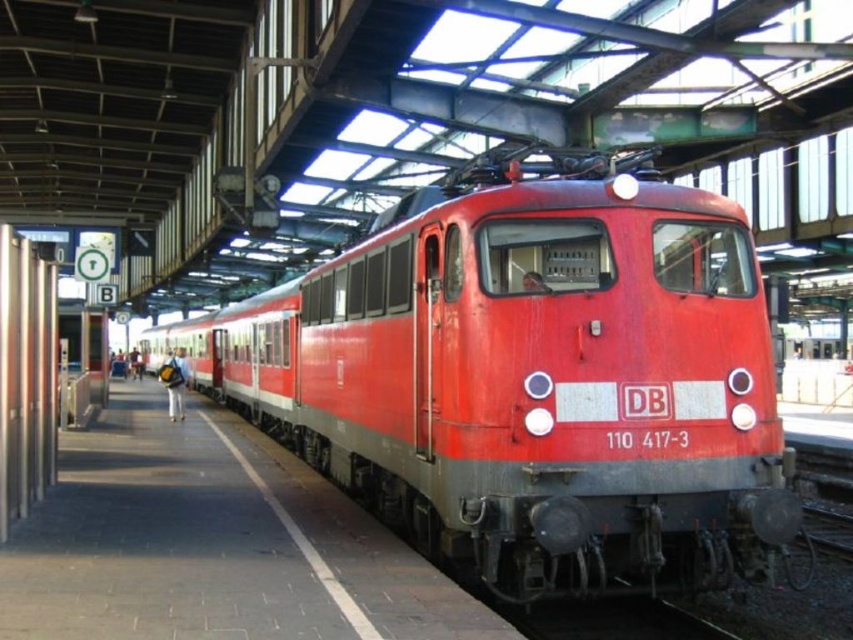
You are a passenger waiting on the smooth concrete platform at center. You want to board the matte red train at center. Which direction should you walk to reach the train?

The matte red train at center is to the right of the smooth concrete platform at center, so you should walk to the right to reach the train.

You are standing on the platform at the train station and see two points marked on the ground. The first point is at position point (428, 243) and the second point is at point (215, 618). If you were to walk from the first point to the second point, would you be moving towards the locomotive or away from it?

Since point (428, 243) is behind point (215, 618), moving from the first point to the second point would mean you are moving towards the locomotive.